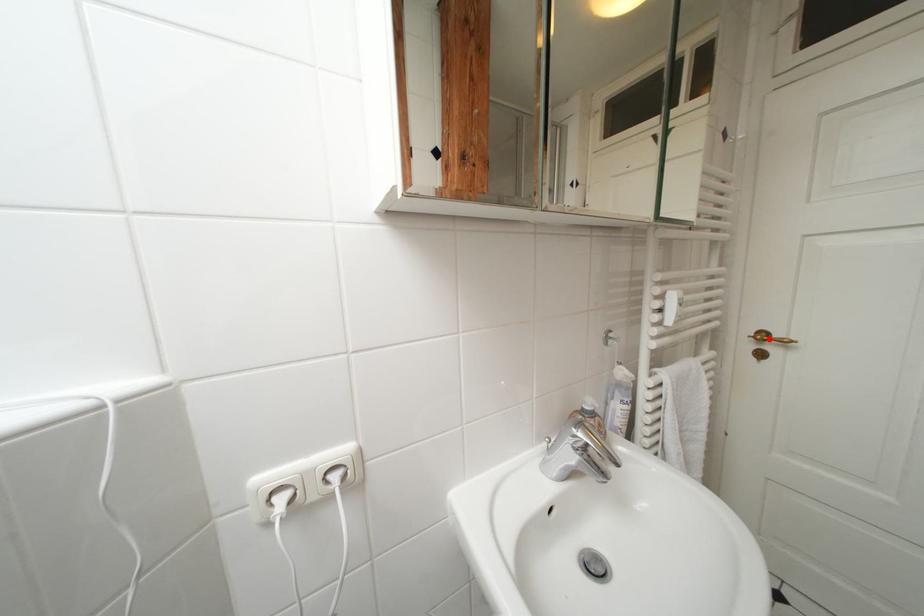
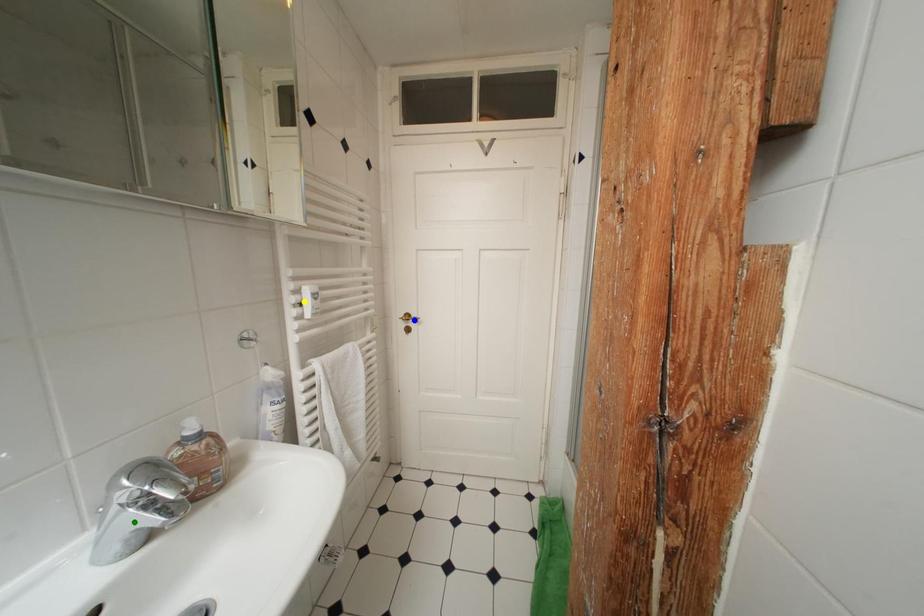
Question: I am providing you with two images of the same scene from different viewpoints. A red point is marked on the first image. You are given multiple points on the second image. Which point in image 2 represents the same 3d spot as the red point in image 1?

Choices:
 (A) green point
 (B) yellow point
 (C) blue point

Answer: (C)